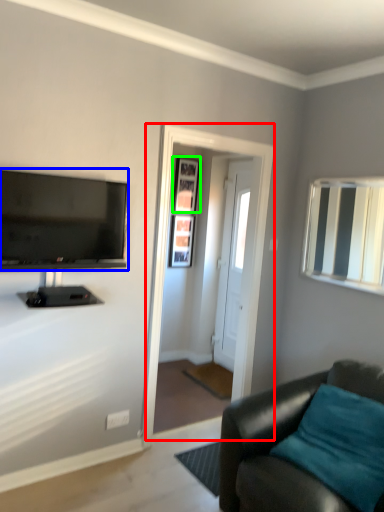
Question: Which object is positioned closest to screen door (highlighted by a red box)? Select from television (highlighted by a blue box) and picture frame (highlighted by a green box).

Choices:
 (A) television
 (B) picture frame

Answer: (A)